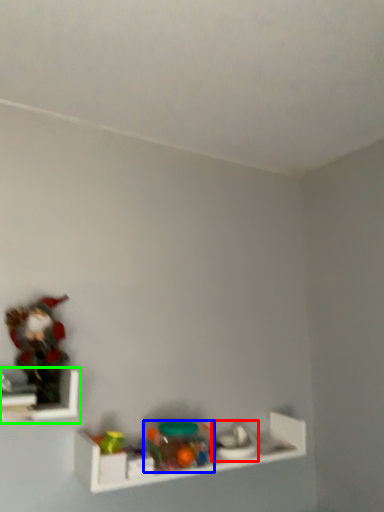
Question: Estimate the real-world distances between objects in this image. Which object is farther from toy (highlighted by a red box), toy (highlighted by a blue box) or shelf (highlighted by a green box)?

Choices:
 (A) toy
 (B) shelf

Answer: (B)